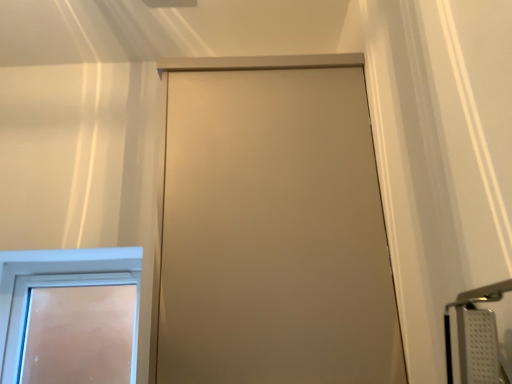
Question: Considering the relative positions of satin beige door at center, which appears as the first door when viewed from the right, and white frosted glass door at lower left, which appears as the 2th door when viewed from the front, in the image provided, is satin beige door at center, which appears as the first door when viewed from the right, to the left of white frosted glass door at lower left, which appears as the 2th door when viewed from the front, from the viewer's perspective?

Choices:
 (A) yes
 (B) no

Answer: (B)

Question: Considering the relative sizes of satin beige door at center, acting as the first door starting from the front, and white frosted glass door at lower left, marked as the first door in a back-to-front arrangement, in the image provided, is satin beige door at center, acting as the first door starting from the front, taller than white frosted glass door at lower left, marked as the first door in a back-to-front arrangement,?

Choices:
 (A) no
 (B) yes

Answer: (B)

Question: Does satin beige door at center, marked as the second door in a back-to-front arrangement, have a greater width compared to white frosted glass door at lower left, marked as the first door in a back-to-front arrangement?

Choices:
 (A) yes
 (B) no

Answer: (A)

Question: Does satin beige door at center, acting as the first door starting from the front, have a smaller size compared to white frosted glass door at lower left, which appears as the 2th door when viewed from the front?

Choices:
 (A) yes
 (B) no

Answer: (B)

Question: From the image's perspective, is satin beige door at center, marked as the second door in a back-to-front arrangement, above white frosted glass door at lower left, which is the 2th door from right to left?

Choices:
 (A) yes
 (B) no

Answer: (A)

Question: Is the position of satin beige door at center, marked as the second door in a back-to-front arrangement, more distant than that of white frosted glass door at lower left, marked as the first door in a left-to-right arrangement?

Choices:
 (A) no
 (B) yes

Answer: (A)

Question: From a real-world perspective, is white frosted glass door at lower left, marked as the first door in a left-to-right arrangement, positioned over satin beige door at center, marked as the second door in a back-to-front arrangement, based on gravity?

Choices:
 (A) yes
 (B) no

Answer: (B)

Question: Is white frosted glass door at lower left, which appears as the 2th door when viewed from the front, at the right side of satin beige door at center, acting as the first door starting from the front?

Choices:
 (A) no
 (B) yes

Answer: (A)

Question: Is white frosted glass door at lower left, which appears as the 2th door when viewed from the front, to the left of satin beige door at center, which is the second door from left to right, from the viewer's perspective?

Choices:
 (A) no
 (B) yes

Answer: (B)

Question: Does white frosted glass door at lower left, which is the 2th door from right to left, have a lesser width compared to satin beige door at center, acting as the first door starting from the front?

Choices:
 (A) no
 (B) yes

Answer: (B)

Question: From the image's perspective, would you say white frosted glass door at lower left, which appears as the 2th door when viewed from the front, is shown under satin beige door at center, which is the second door from left to right?

Choices:
 (A) yes
 (B) no

Answer: (A)

Question: From a real-world perspective, is white frosted glass door at lower left, which appears as the 2th door when viewed from the front, physically below satin beige door at center, which appears as the first door when viewed from the right?

Choices:
 (A) no
 (B) yes

Answer: (B)

Question: From the image's perspective, is satin beige door at center, which is the second door from left to right, above or below white frosted glass door at lower left, marked as the first door in a left-to-right arrangement?

Choices:
 (A) below
 (B) above

Answer: (B)